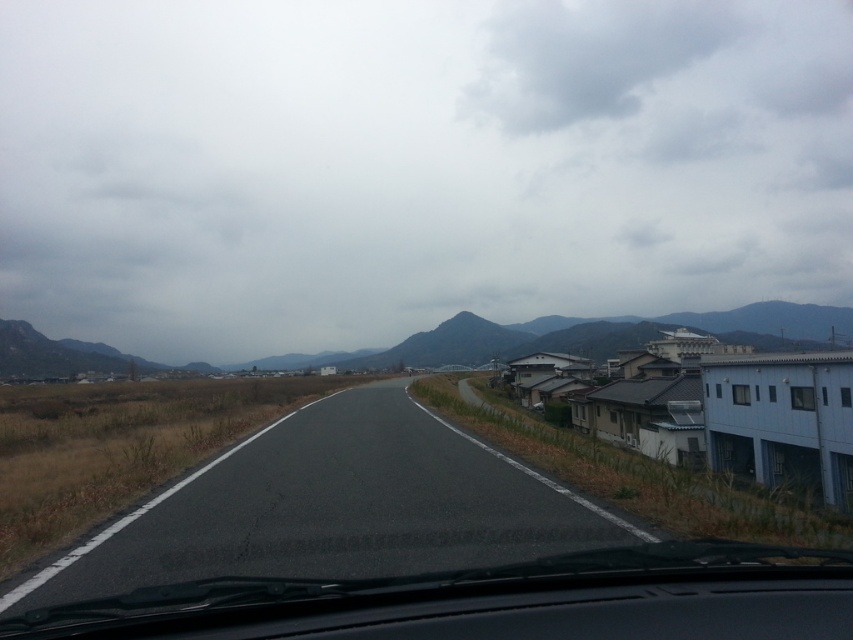
Question: Is asphalt road at center above transparent glass windshield at center?

Choices:
 (A) no
 (B) yes

Answer: (A)

Question: Can you confirm if asphalt road at center is thinner than transparent glass windshield at center?

Choices:
 (A) yes
 (B) no

Answer: (B)

Question: Is asphalt road at center thinner than transparent glass windshield at center?

Choices:
 (A) no
 (B) yes

Answer: (A)

Question: Among these points, which one is nearest to the camera?

Choices:
 (A) (61, 570)
 (B) (527, 570)

Answer: (B)